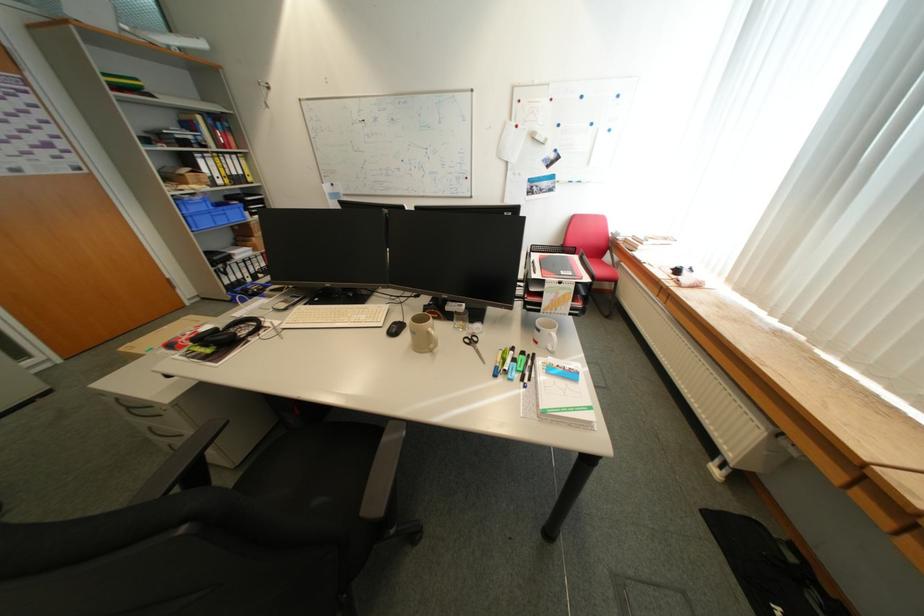
The height and width of the screenshot is (616, 924). What do you see at coordinates (555, 277) in the screenshot?
I see `the black binder` at bounding box center [555, 277].